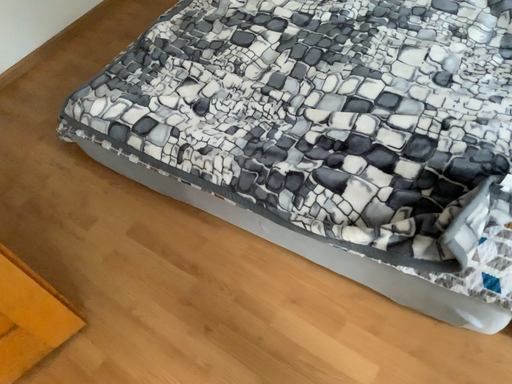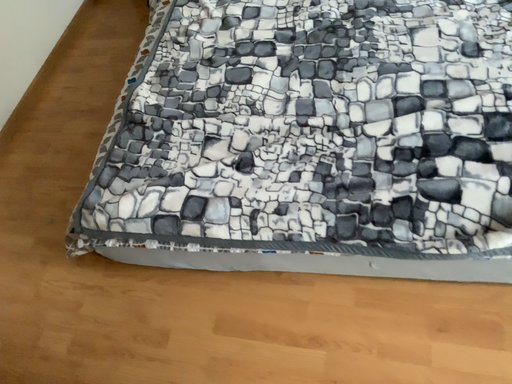
Question: Which way did the camera rotate in the video?

Choices:
 (A) rotated left
 (B) rotated right

Answer: (B)